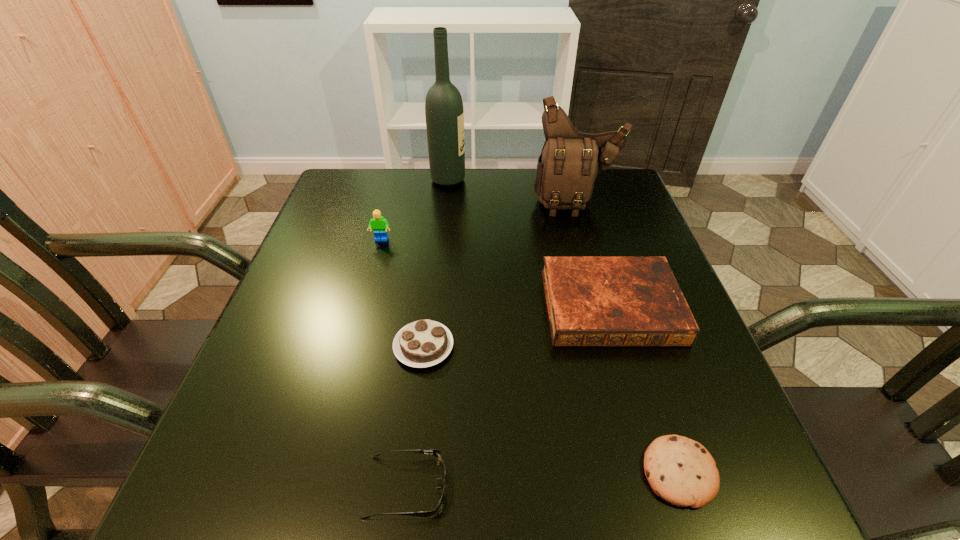
At what (x,y) coordinates should I click in order to perform the action: click on free space located 0.290m on the face of the fifth shortest object. Please return your answer as a coordinate pair (x, y). Image resolution: width=960 pixels, height=540 pixels. Looking at the image, I should click on (355, 341).

This screenshot has width=960, height=540. Identify the location of free space located on the spine side of the Bible. (644, 417).

This screenshot has height=540, width=960. Identify the location of vacant area situated on the back of the third shortest object. (436, 245).

Locate an element on the screen. vacant region located 0.300m on the back of the cookie is located at coordinates (622, 299).

Identify the location of free space located on the front-facing side of the sunglasses. (721, 487).

Find the location of a particular element. The image size is (960, 540). wine bottle located in the far edge section of the desktop is located at coordinates (444, 113).

Find the location of a particular element. Image resolution: width=960 pixels, height=540 pixels. shoulder bag that is at the far edge is located at coordinates (570, 161).

Where is `cookie that is at the near edge`? The height and width of the screenshot is (540, 960). cookie that is at the near edge is located at coordinates (681, 471).

I want to click on sunglasses that is at the near edge, so click(x=437, y=453).

At what (x,y) coordinates should I click in order to perform the action: click on object present at the left edge. Please return your answer as a coordinate pair (x, y). The height and width of the screenshot is (540, 960). Looking at the image, I should click on (379, 225).